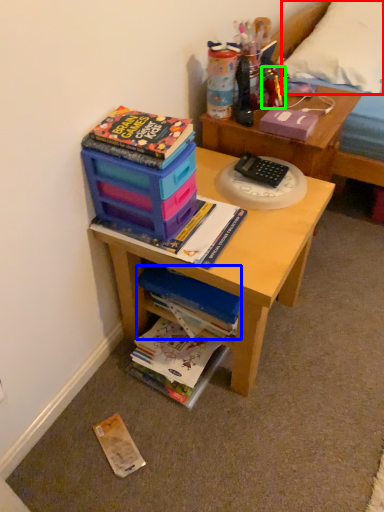
Question: Based on their relative distances, which object is farther from pillow (highlighted by a red box)? Choose from book (highlighted by a blue box) and toy (highlighted by a green box).

Choices:
 (A) book
 (B) toy

Answer: (A)